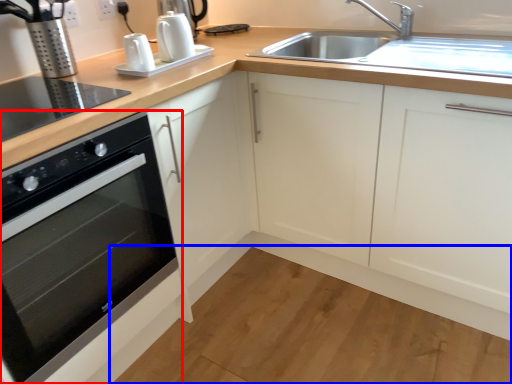
Question: Which object is further to the camera taking this photo, home appliance (highlighted by a red box) or plain (highlighted by a blue box)?

Choices:
 (A) home appliance
 (B) plain

Answer: (B)